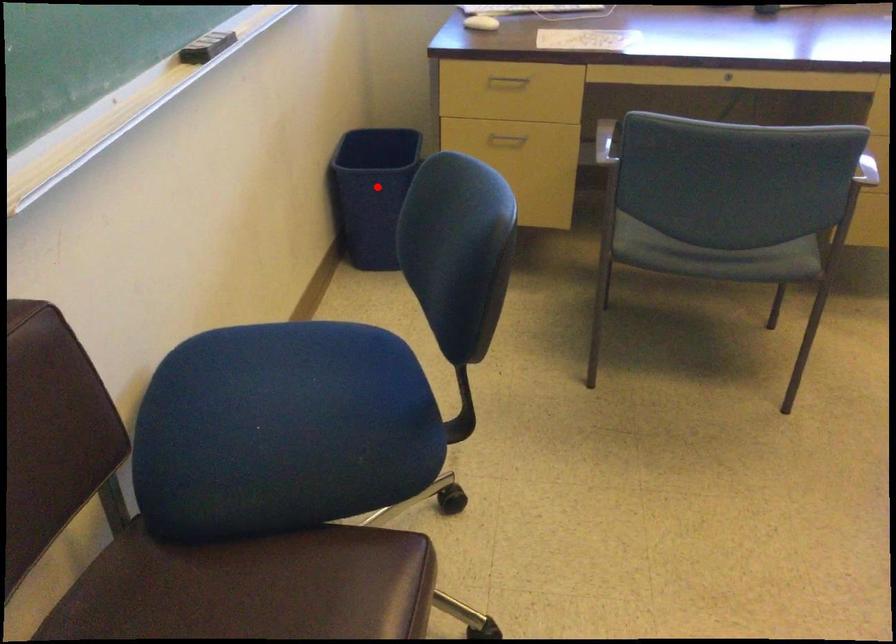
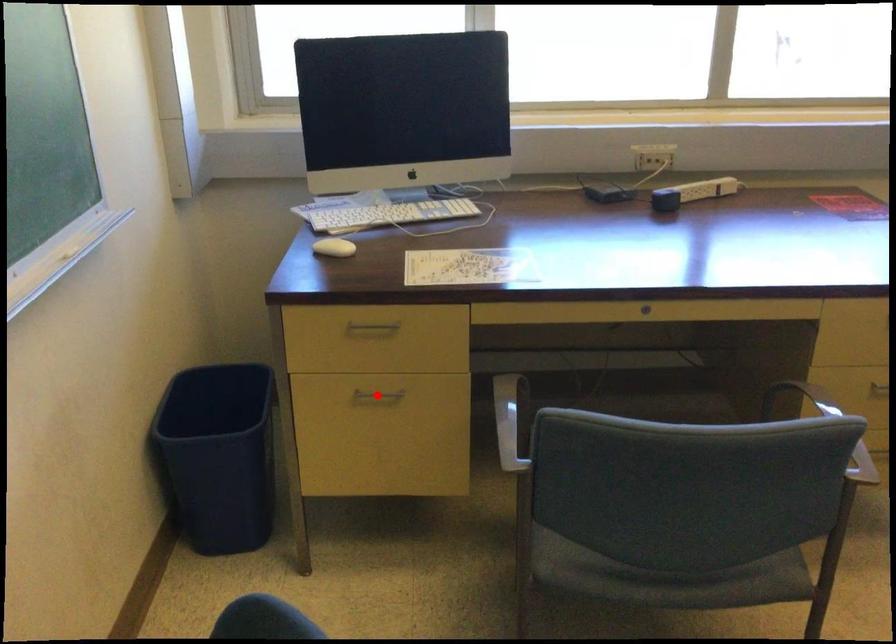
I am providing you with two images of the same scene from different viewpoints. A red point is marked on the first image and another point is marked on the second image. Is the marked point in image1 the same physical position as the marked point in image2?

No